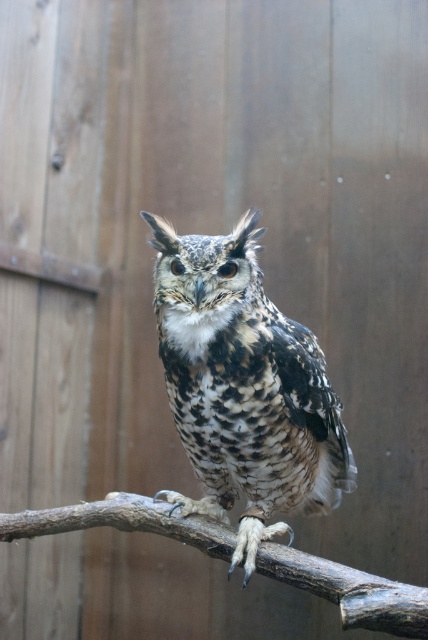
Between point (214, 500) and point (198, 541), which one is positioned behind?

Positioned behind is point (214, 500).

Does speckled feathered owl at center appear on the left side of brown rough tree branch at center?

Incorrect, speckled feathered owl at center is not on the left side of brown rough tree branch at center.

Is point (207, 502) more distant than point (427, 620)?

Yes.

Identify the location of speckled feathered owl at center. This screenshot has width=428, height=640. (243, 387).